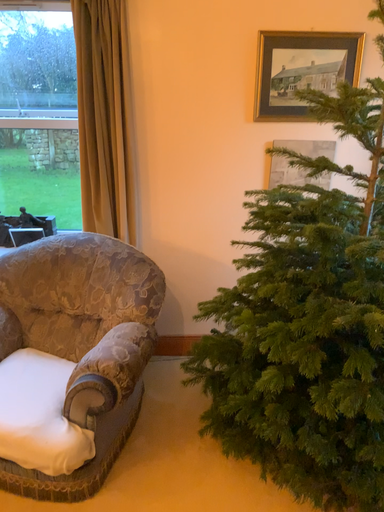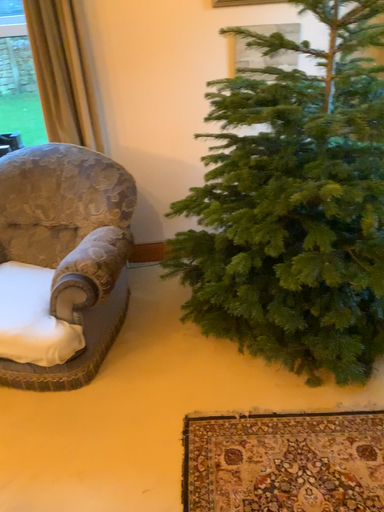
Question: How did the camera likely rotate when shooting the video?

Choices:
 (A) rotated upward
 (B) rotated downward

Answer: (B)